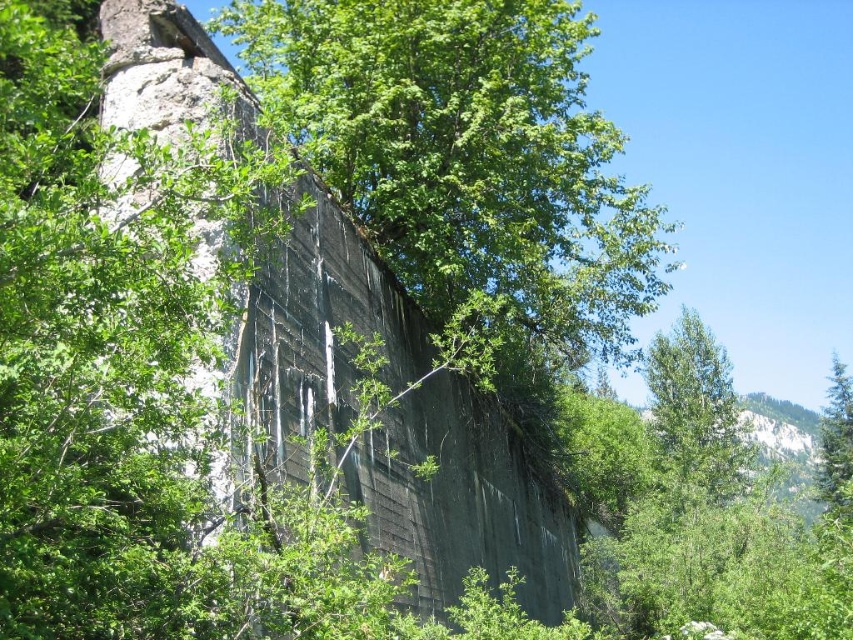
The width and height of the screenshot is (853, 640). What do you see at coordinates (463, 500) in the screenshot?
I see `rough concrete wall at center` at bounding box center [463, 500].

Who is lower down, rough concrete wall at center or green leafy tree at upper right?

green leafy tree at upper right is below.

Between point (155, 29) and point (733, 413), which one is positioned behind?

The point (733, 413) is more distant.

This screenshot has height=640, width=853. What are the coordinates of `rough concrete wall at center` in the screenshot? It's located at (463, 500).

Does green leafy tree at upper right have a lesser width compared to green textured pine tree at right?

Yes.

Does green leafy tree at upper right have a greater height compared to green textured pine tree at right?

Correct, green leafy tree at upper right is much taller as green textured pine tree at right.

Is point (718, 435) positioned before point (843, 420)?

Yes.

This screenshot has width=853, height=640. I want to click on green leafy tree at upper right, so click(x=695, y=410).

Is rough concrete wall at center behind green textured pine tree at right?

That is False.

Consider the image. Is rough concrete wall at center thinner than green textured pine tree at right?

Correct, rough concrete wall at center's width is less than green textured pine tree at right's.

Image resolution: width=853 pixels, height=640 pixels. In order to click on rough concrete wall at center in this screenshot , I will do `click(463, 500)`.

Locate an element on the screen. rough concrete wall at center is located at coordinates (463, 500).